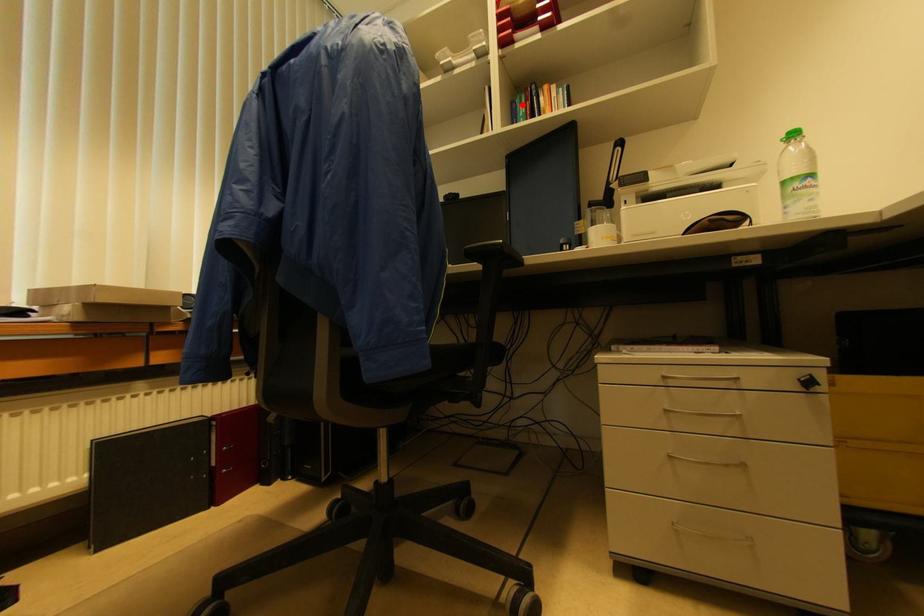
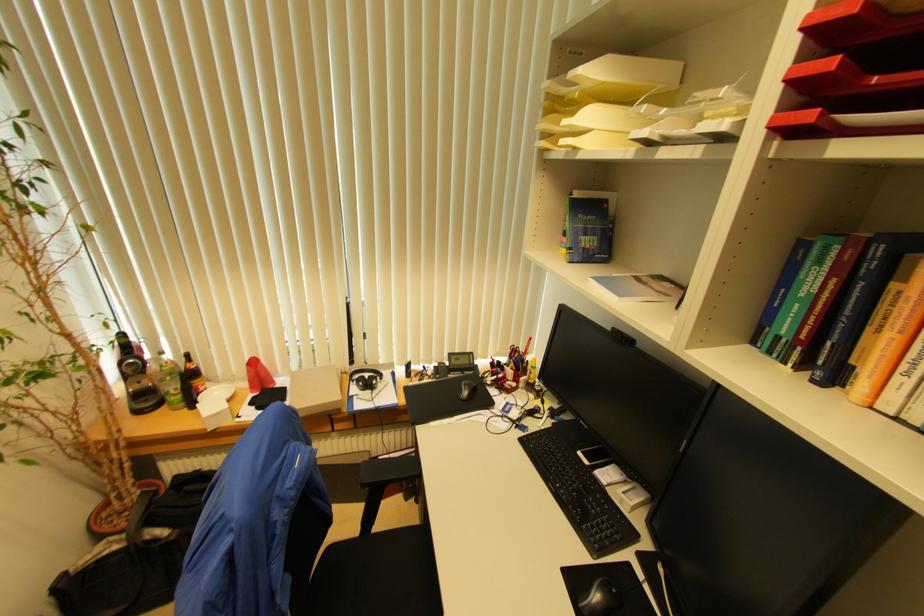
Question: I am providing you with two images of the same scene from different viewpoints. In image1, a red point is highlighted. Considering the same 3D point in image2, which of the following is correct?

Choices:
 (A) It is closer
 (B) It is farther

Answer: (B)